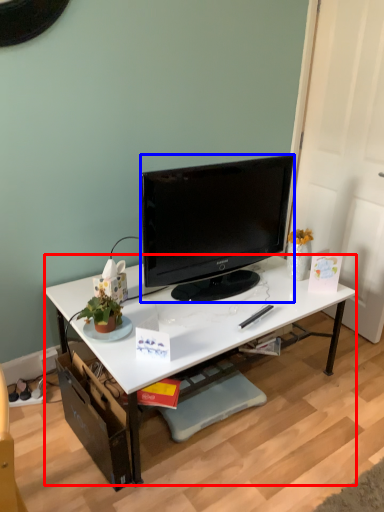
Question: Which point is closer to the camera, desk (highlighted by a red box) or television (highlighted by a blue box)?

Choices:
 (A) desk
 (B) television

Answer: (A)